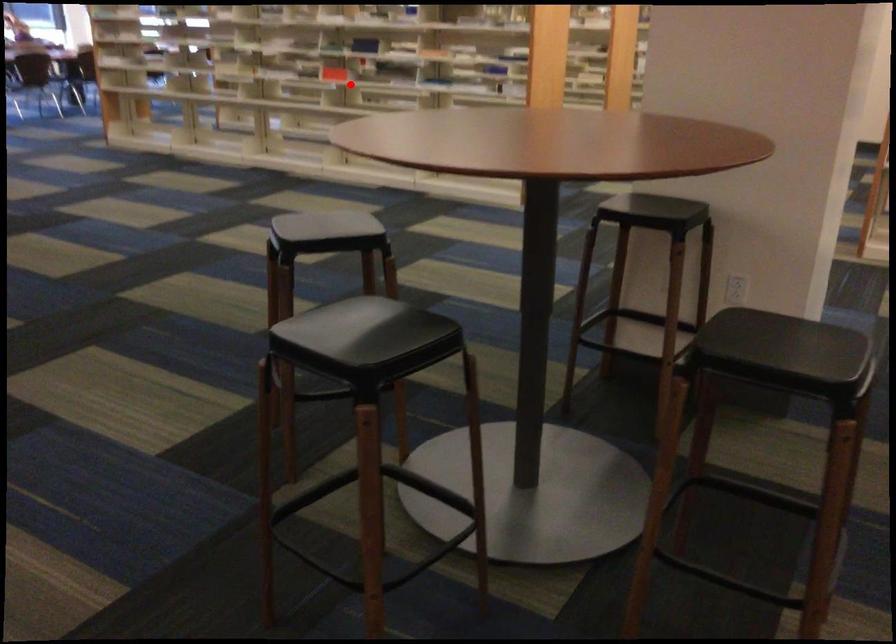
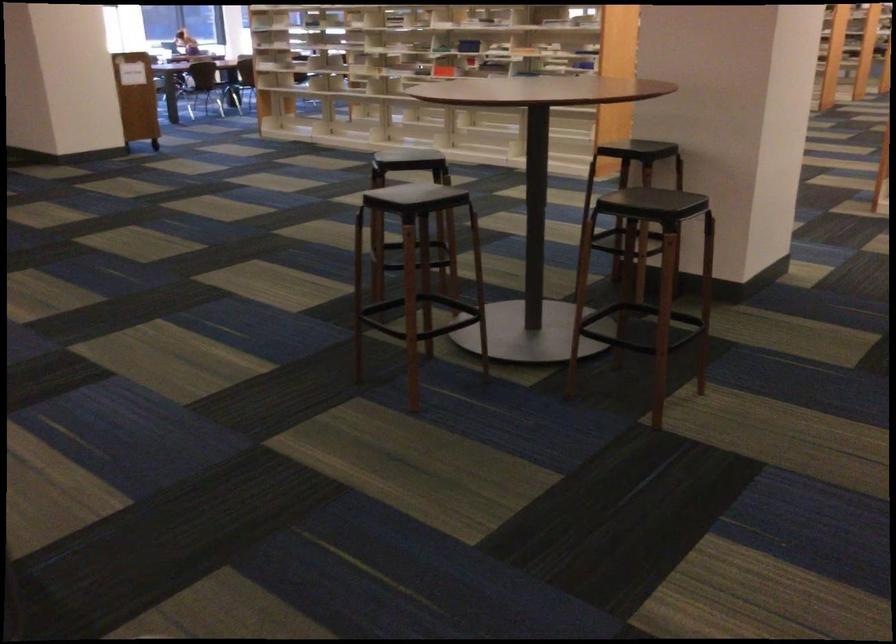
Question: I am providing you with two images of the same scene from different viewpoints. A red point is shown in image1. For the corresponding object point in image2, is it positioned nearer or farther from the camera?

Choices:
 (A) Nearer
 (B) Farther

Answer: (B)